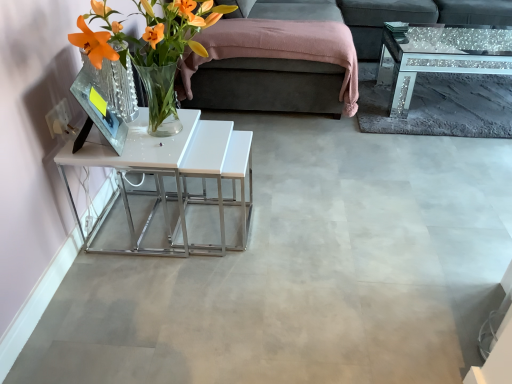
This screenshot has height=384, width=512. Identify the location of free spot below white glossy table at left (from a real-world perspective). (173, 219).